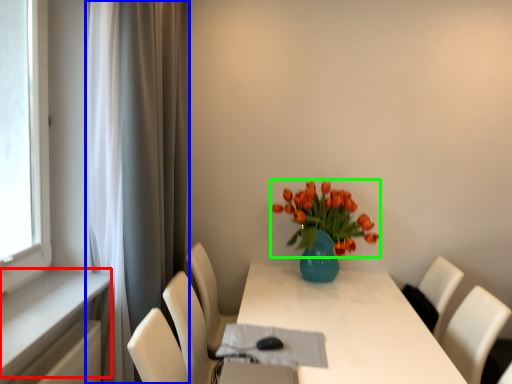
Question: Which object is positioned closest to window sill (highlighted by a red box)? Select from curtain (highlighted by a blue box) and flower (highlighted by a green box).

Choices:
 (A) curtain
 (B) flower

Answer: (A)